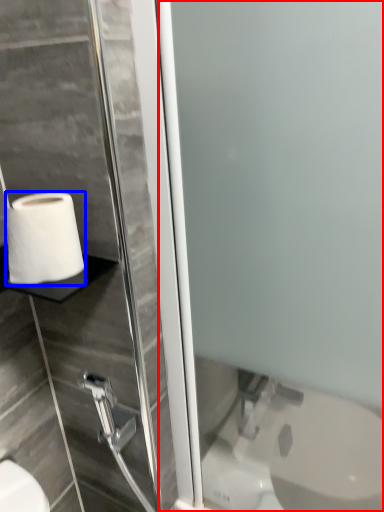
Question: Which object is further to the camera taking this photo, screen door (highlighted by a red box) or toilet paper (highlighted by a blue box)?

Choices:
 (A) screen door
 (B) toilet paper

Answer: (B)